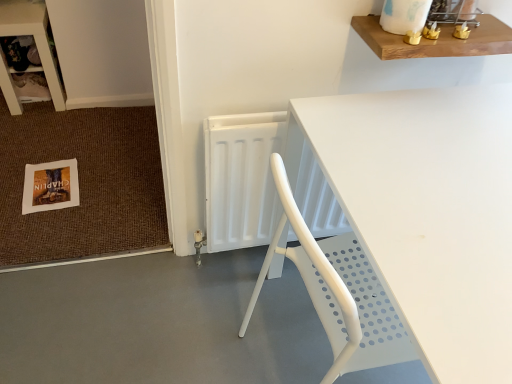
Where is `free spot above white paper postcard at lower left (from a real-world perspective)`? This screenshot has width=512, height=384. free spot above white paper postcard at lower left (from a real-world perspective) is located at coordinates (54, 182).